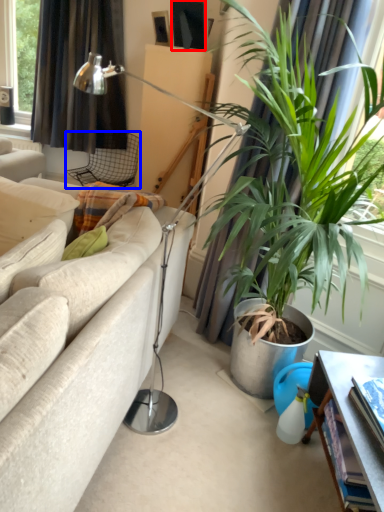
Question: Which of the following is the closest to the observer, picture frame (highlighted by a red box) or chair (highlighted by a blue box)?

Choices:
 (A) picture frame
 (B) chair

Answer: (A)